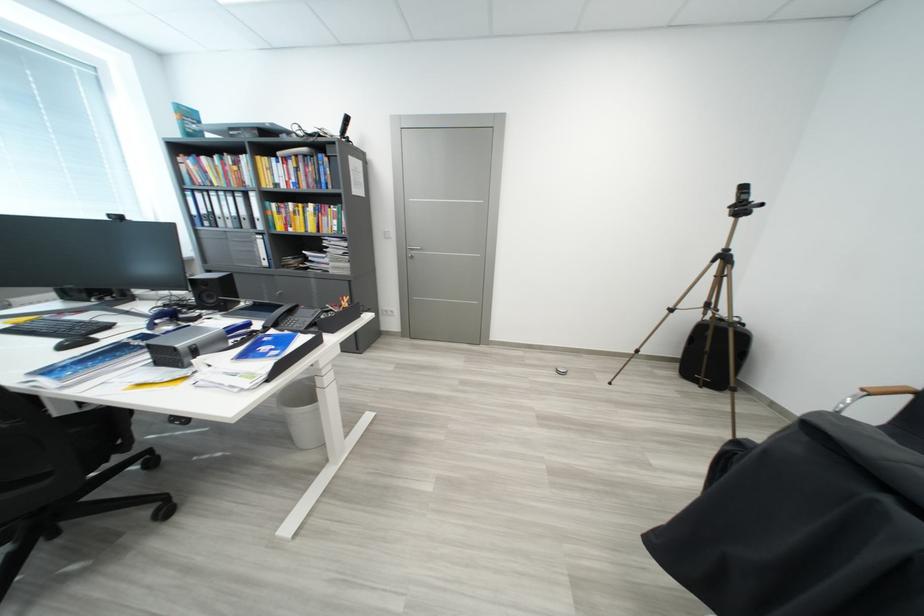
Where would you turn the silver door handle? Please return your answer as a coordinate pair (x, y).

(411, 251)